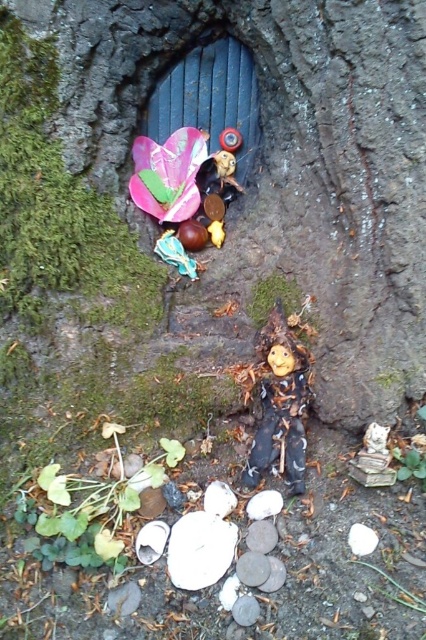
Consider the image. Can you confirm if wooden doll at center is smaller than smooth white stone at lower center?

Incorrect, wooden doll at center is not smaller in size than smooth white stone at lower center.

Is point (305, 381) positioned before point (265, 566)?

No, it is not.

Is point (299, 371) more distant than point (259, 564)?

Yes, point (299, 371) is behind point (259, 564).

Where is `wooden doll at center`? Image resolution: width=426 pixels, height=640 pixels. wooden doll at center is located at coordinates (279, 403).

Between wooden doll at center and shiny plastic flower at upper left, which one is positioned higher?

shiny plastic flower at upper left is higher up.

Can you confirm if wooden doll at center is wider than shiny plastic flower at upper left?

No.

Is point (256, 483) behind point (166, 189)?

No, it is not.

You are a GUI agent. You are given a task and a screenshot of the screen. Output one action in this format:
    pyautogui.click(x=<x>, y=<y>)
    Task: Click on the wooden doll at center
    
    Given the screenshot: What is the action you would take?
    pyautogui.click(x=279, y=403)

Is point (181, 211) farther from viewer compared to point (255, 556)?

That is True.

Which of these two, shiny plastic flower at upper left or smooth white stone at lower center, stands shorter?

smooth white stone at lower center

Who is more forward, (x=137, y=177) or (x=238, y=556)?

Point (x=238, y=556)

Where is `shiny plastic flower at upper left`? The height and width of the screenshot is (640, 426). shiny plastic flower at upper left is located at coordinates (175, 173).